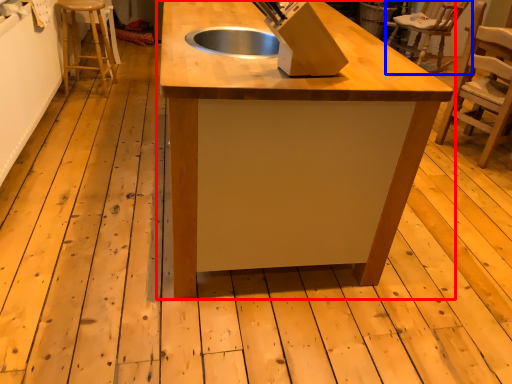
Question: Which object is closer to the camera taking this photo, table (highlighted by a red box) or chair (highlighted by a blue box)?

Choices:
 (A) table
 (B) chair

Answer: (A)